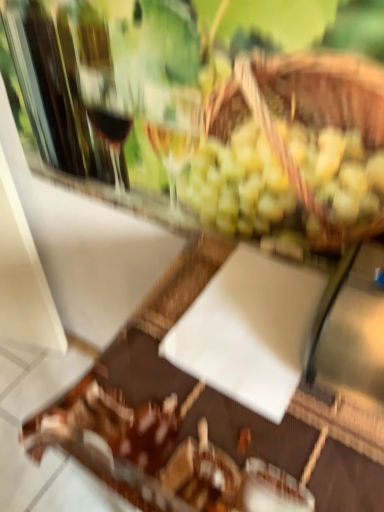
Question: Relative to white matte cutting board at center, is matte glass wine glass at upper center in front or behind?

Choices:
 (A) behind
 (B) front

Answer: (A)

Question: Looking at their shapes, would you say matte glass wine glass at upper center is wider or thinner than white matte cutting board at center?

Choices:
 (A) thin
 (B) wide

Answer: (A)

Question: From the image's perspective, is matte glass wine glass at upper center above or below white matte cutting board at center?

Choices:
 (A) below
 (B) above

Answer: (B)

Question: Is white matte cutting board at center inside the boundaries of matte glass wine glass at upper center, or outside?

Choices:
 (A) inside
 (B) outside

Answer: (B)

Question: Is point click(x=178, y=296) closer or farther from the camera than point click(x=190, y=89)?

Choices:
 (A) farther
 (B) closer

Answer: (A)

Question: From their relative heights in the image, would you say white matte cutting board at center is taller or shorter than matte glass wine glass at upper center?

Choices:
 (A) short
 (B) tall

Answer: (B)

Question: From the image's perspective, is white matte cutting board at center located above or below matte glass wine glass at upper center?

Choices:
 (A) below
 (B) above

Answer: (A)